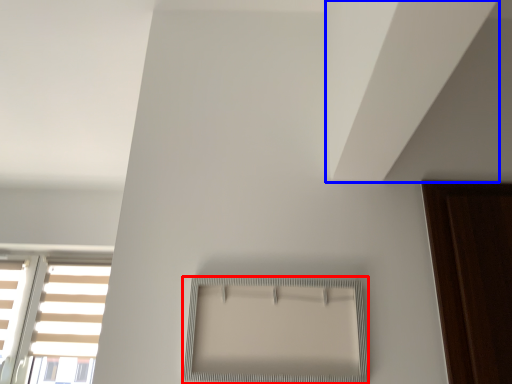
Question: Which point is closer to the camera, window (highlighted by a red box) or blind (highlighted by a blue box)?

Choices:
 (A) window
 (B) blind

Answer: (B)